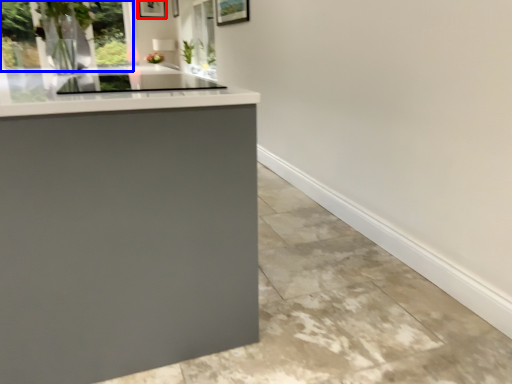
Question: Among these objects, which one is nearest to the camera, picture frame (highlighted by a red box) or window (highlighted by a blue box)?

Choices:
 (A) picture frame
 (B) window

Answer: (B)